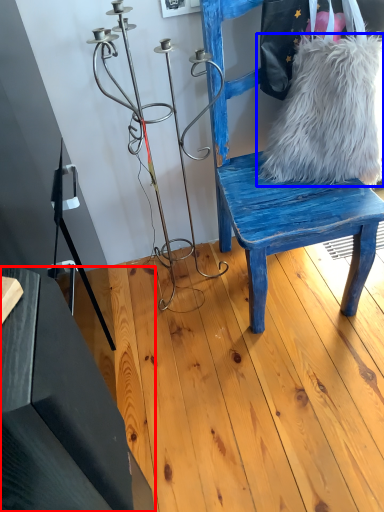
Question: Which of the following is the farthest to the observer, table (highlighted by a red box) or fur (highlighted by a blue box)?

Choices:
 (A) table
 (B) fur

Answer: (B)